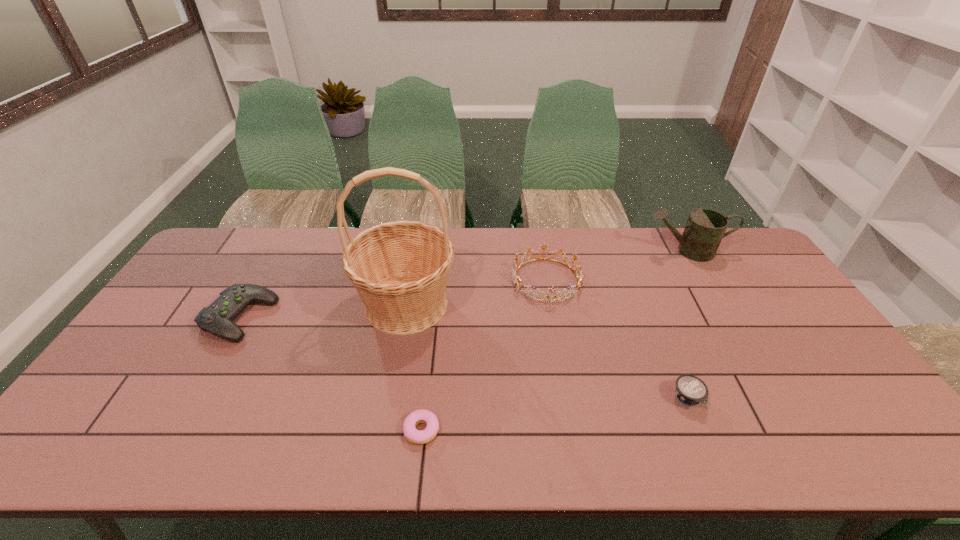
You are a GUI agent. You are given a task and a screenshot of the screen. Output one action in this format:
    pyautogui.click(x=<x>, y=<y>)
    Task: Click on the tallest object
    This screenshot has height=540, width=960.
    Given the screenshot: What is the action you would take?
    pyautogui.click(x=400, y=269)

This screenshot has width=960, height=540. I want to click on the fifth shortest object, so click(x=705, y=228).

This screenshot has width=960, height=540. Identify the location of the rightmost object. (705, 228).

Locate an element on the screen. The width and height of the screenshot is (960, 540). the fourth object from left to right is located at coordinates (516, 279).

Identify the location of the third tallest object. (516, 279).

Image resolution: width=960 pixels, height=540 pixels. I want to click on the third shortest object, so click(x=217, y=318).

What are the coordinates of `control` in the screenshot? It's located at (217, 318).

I want to click on the fifth object from left to right, so click(x=690, y=390).

This screenshot has width=960, height=540. Find the location of `the second shortest object`. the second shortest object is located at coordinates (690, 390).

Where is `doughnut`? doughnut is located at coordinates (415, 436).